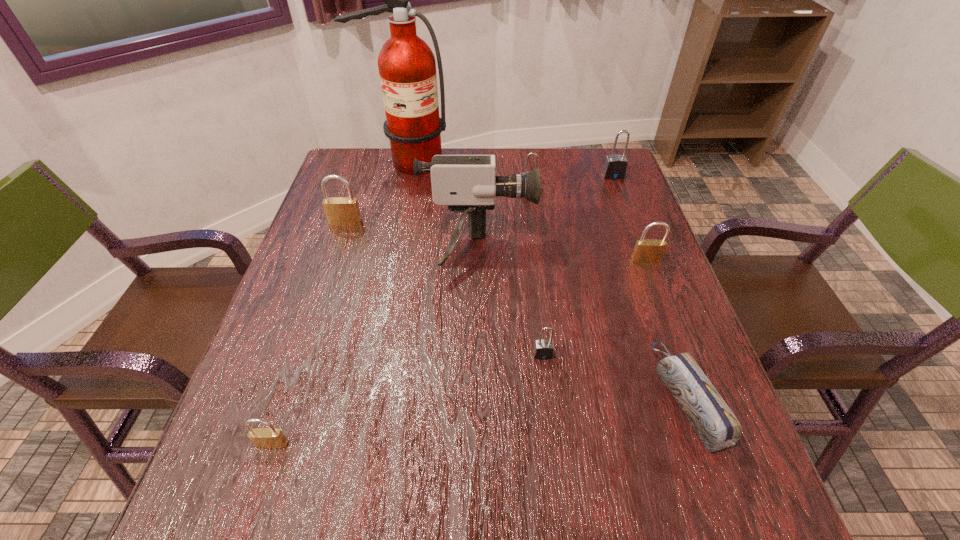
In the image, there is a desktop. Identify the location of free region at the far edge. This screenshot has width=960, height=540. (421, 186).

Where is `vacant space at the near edge of the desktop`? The width and height of the screenshot is (960, 540). vacant space at the near edge of the desktop is located at coordinates (325, 501).

You are a GUI agent. You are given a task and a screenshot of the screen. Output one action in this format:
    pyautogui.click(x=<x>, y=<y>)
    Task: Click on the vacant space at the left edge of the desktop
    The height and width of the screenshot is (540, 960).
    Given the screenshot: What is the action you would take?
    pyautogui.click(x=315, y=266)

The width and height of the screenshot is (960, 540). In the image, there is a desktop. What are the coordinates of `free space at the right edge` in the screenshot? It's located at (623, 278).

At what (x,y) coordinates should I click in order to perform the action: click on vacant point at the near left corner. Please return your answer as a coordinate pair (x, y). The width and height of the screenshot is (960, 540). Looking at the image, I should click on (274, 504).

You are a GUI agent. You are given a task and a screenshot of the screen. Output one action in this format:
    pyautogui.click(x=<x>, y=<y>)
    Task: Click on the vacant space at the far right corner
    
    Given the screenshot: What is the action you would take?
    pyautogui.click(x=577, y=149)

The width and height of the screenshot is (960, 540). I want to click on free space that is in between the farthest brass padlock and the second nearest gray padlock, so click(x=438, y=206).

Find the location of a particular element. vacant point located between the nearest gray padlock and the rightmost brass padlock is located at coordinates (594, 307).

The height and width of the screenshot is (540, 960). I want to click on free spot between the smallest brass padlock and the shortest object, so click(480, 421).

Find the location of `vacant region between the nearest brass padlock and the fire extinguisher`. vacant region between the nearest brass padlock and the fire extinguisher is located at coordinates (340, 303).